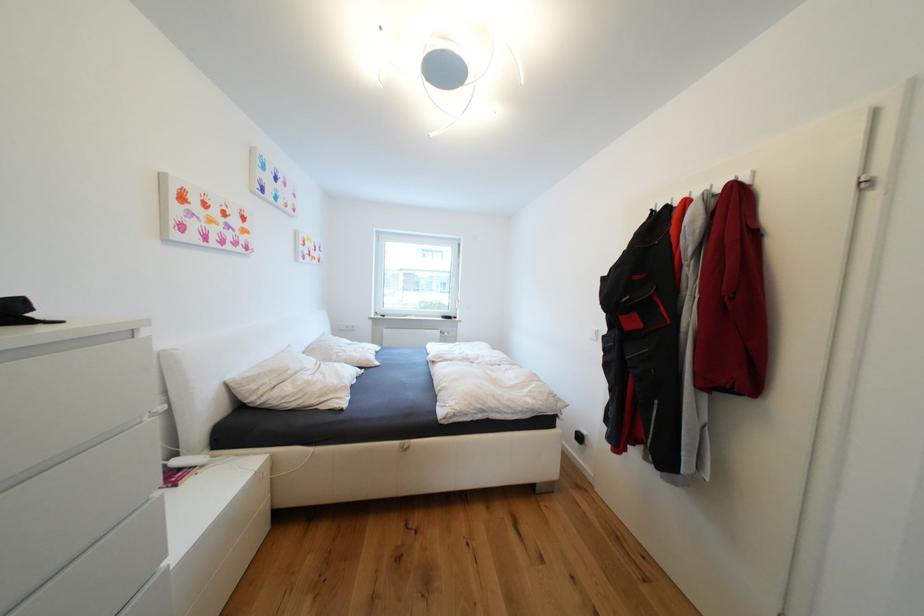
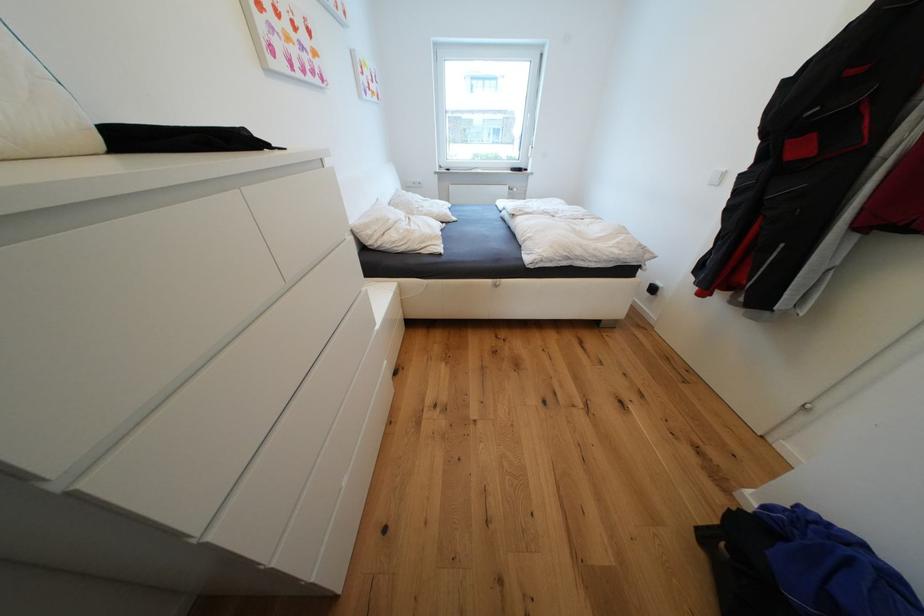
The point at (447, 359) is marked in the first image. Where is the corresponding point in the second image?

(528, 212)